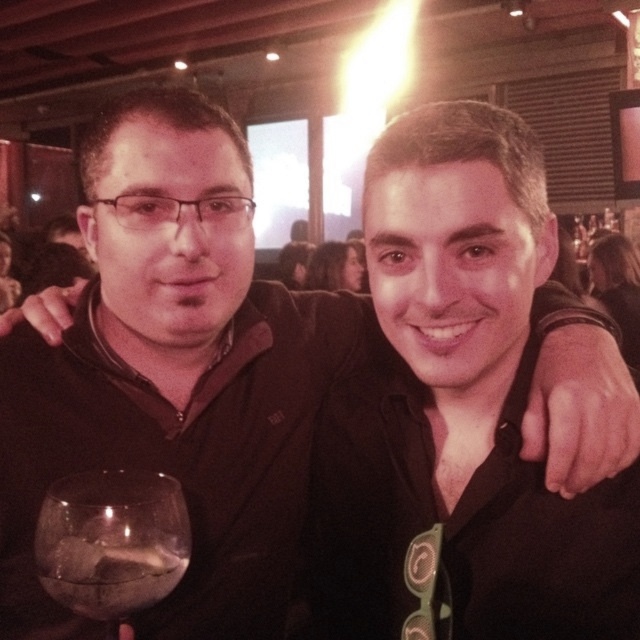
Question: Can you confirm if transparent glass at lower left is smaller than translucent glass wine at lower left?

Choices:
 (A) yes
 (B) no

Answer: (B)

Question: Where is transparent glass at lower left located in relation to translucent glass wine at lower left in the image?

Choices:
 (A) above
 (B) below

Answer: (A)

Question: Which point is closer to the camera?

Choices:
 (A) (148, 522)
 (B) (109, 598)

Answer: (B)

Question: Can you confirm if transparent glass at lower left is positioned to the left of translucent glass wine at lower left?

Choices:
 (A) yes
 (B) no

Answer: (A)